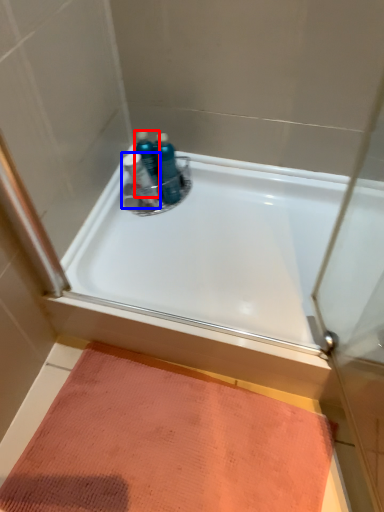
Question: Which object appears closest to the camera in this image, toiletry (highlighted by a red box) or toiletry (highlighted by a blue box)?

Choices:
 (A) toiletry
 (B) toiletry

Answer: (B)